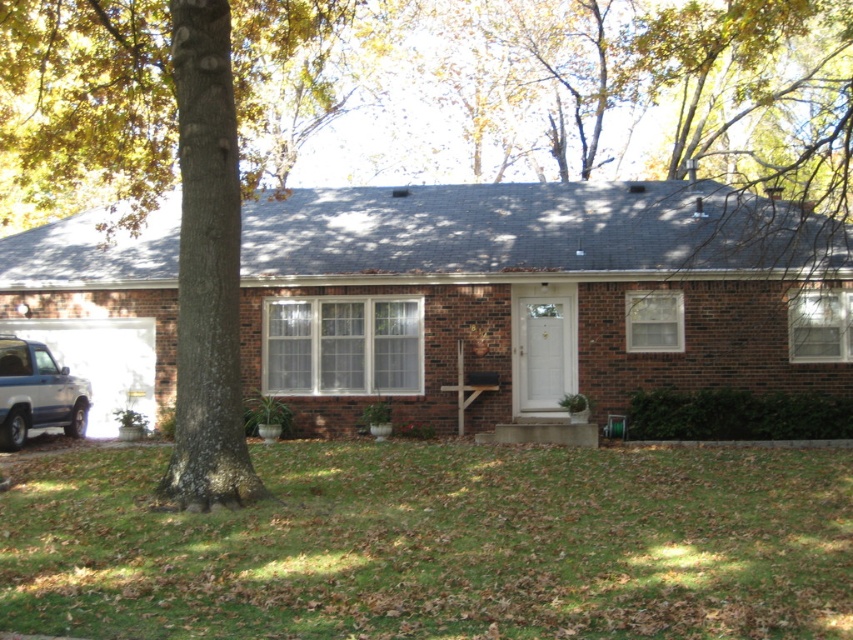
Question: Which point is farther to the camera?

Choices:
 (A) (294, 570)
 (B) (49, 410)

Answer: (B)

Question: Is green grass at lower center wider than satin silver suv at lower left?

Choices:
 (A) no
 (B) yes

Answer: (B)

Question: Which object appears farthest from the camera in this image?

Choices:
 (A) satin silver suv at lower left
 (B) green grass at lower center

Answer: (A)

Question: Can you confirm if green grass at lower center is bigger than satin silver suv at lower left?

Choices:
 (A) no
 (B) yes

Answer: (B)

Question: Does green grass at lower center lie behind satin silver suv at lower left?

Choices:
 (A) no
 (B) yes

Answer: (A)

Question: Among these points, which one is nearest to the camera?

Choices:
 (A) (0, 376)
 (B) (833, 580)

Answer: (B)